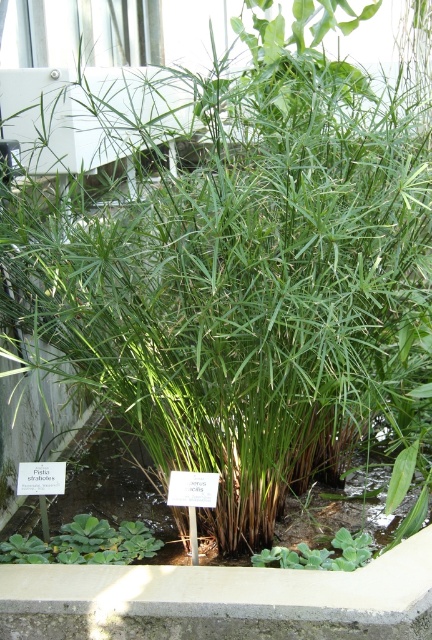
Between point (48, 557) and point (289, 563), which one is positioned in front?

Positioned in front is point (289, 563).

Between green leafy plant at lower left and green leafy plant at lower center, which one appears on the left side from the viewer's perspective?

green leafy plant at lower left

Locate an element on the screen. The width and height of the screenshot is (432, 640). green leafy plant at lower left is located at coordinates (85, 544).

Is concrete ledge at center to the left of green leafy plant at lower left from the viewer's perspective?

In fact, concrete ledge at center is to the right of green leafy plant at lower left.

Which is behind, point (400, 592) or point (102, 552)?

Positioned behind is point (102, 552).

Identify the location of concrete ledge at center. (222, 600).

Does concrete ledge at center have a lesser height compared to green leafy plant at lower center?

No, concrete ledge at center is not shorter than green leafy plant at lower center.

Can you confirm if concrete ledge at center is positioned to the right of green leafy plant at lower center?

Incorrect, concrete ledge at center is not on the right side of green leafy plant at lower center.

Locate an element on the screen. The width and height of the screenshot is (432, 640). concrete ledge at center is located at coordinates (222, 600).